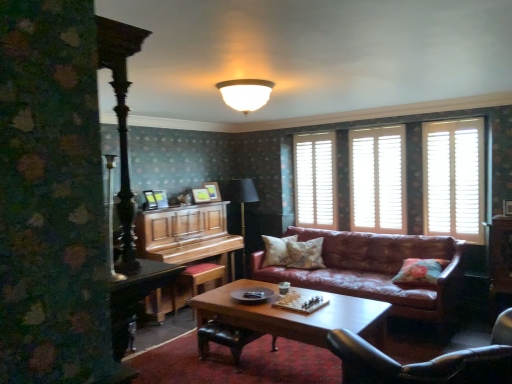
Question: From a real-world perspective, is black leather footrest at lower center physically located above or below leather couch at center?

Choices:
 (A) above
 (B) below

Answer: (B)

Question: Is point click(236, 360) closer or farther from the camera than point click(423, 251)?

Choices:
 (A) closer
 (B) farther

Answer: (A)

Question: Estimate the real-world distances between objects in this image. Which object is farther from the black leather chair at lower right?

Choices:
 (A) leather couch at center
 (B) white wooden shutters at upper right
 (C) black leather footrest at lower center
 (D) white wooden shutters at center, which ranks as the first bay window in back-to-front order
 (E) wooden glossy coffee table at center

Answer: (B)

Question: Estimate the real-world distances between objects in this image. Which object is farther from the wooden glossy coffee table at center?

Choices:
 (A) fluffy beige pillow at center, the second pillow positioned from the front
 (B) white frosted glass lampshade at upper center
 (C) floral fabric pillow at right, marked as the 1th pillow in a right-to-left arrangement
 (D) leather couch at center
 (E) white wooden shutters at center, which is the 2th bay window from front to back

Answer: (E)